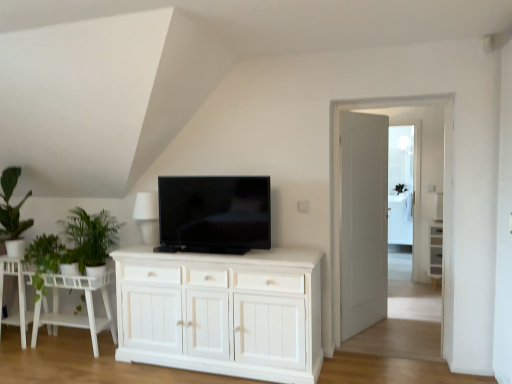
This screenshot has height=384, width=512. Find the location of `free spot in front of white wood table at lower left, which is the 1th table in right-to-left order`. free spot in front of white wood table at lower left, which is the 1th table in right-to-left order is located at coordinates (68, 369).